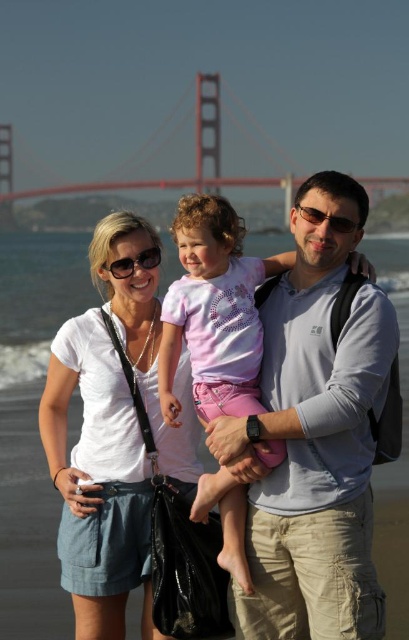
Which is behind, point (310, 310) or point (177, 468)?

Positioned behind is point (177, 468).

Is gray cotton shirt at center closer to camera compared to white cotton shirt at center?

Yes.

This screenshot has height=640, width=409. In order to click on gray cotton shirt at center in this screenshot , I will do `click(314, 435)`.

Is white cotton shirt at center to the right of red painted steel bridge at upper center from the viewer's perspective?

Indeed, white cotton shirt at center is positioned on the right side of red painted steel bridge at upper center.

Can you confirm if white cotton shirt at center is taller than red painted steel bridge at upper center?

No.

Find the location of a particular element. The height and width of the screenshot is (640, 409). white cotton shirt at center is located at coordinates (98, 481).

Based on the photo, how far apart are gray cotton shirt at center and red painted steel bridge at upper center?

gray cotton shirt at center and red painted steel bridge at upper center are 264.03 meters apart.

Image resolution: width=409 pixels, height=640 pixels. In order to click on gray cotton shirt at center in this screenshot , I will do `click(314, 435)`.